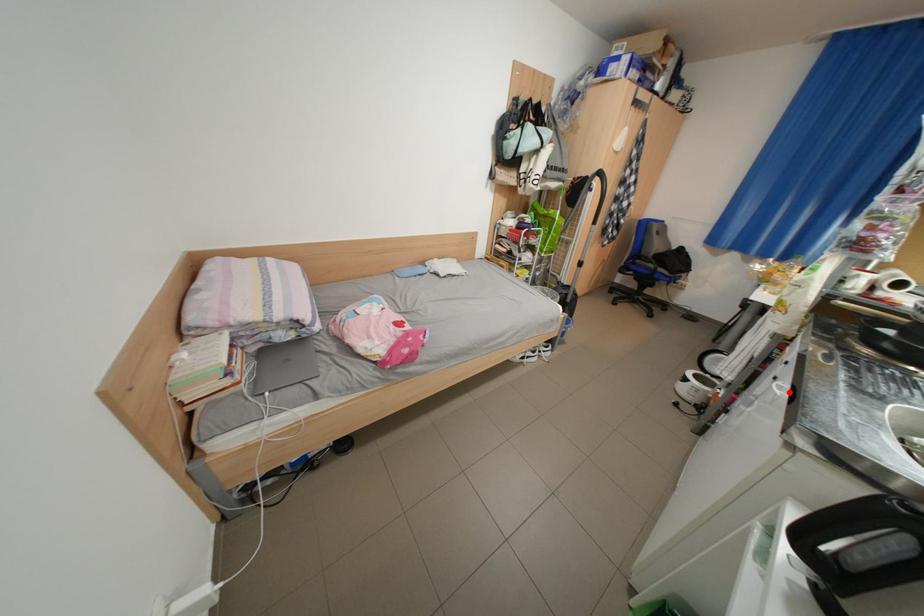
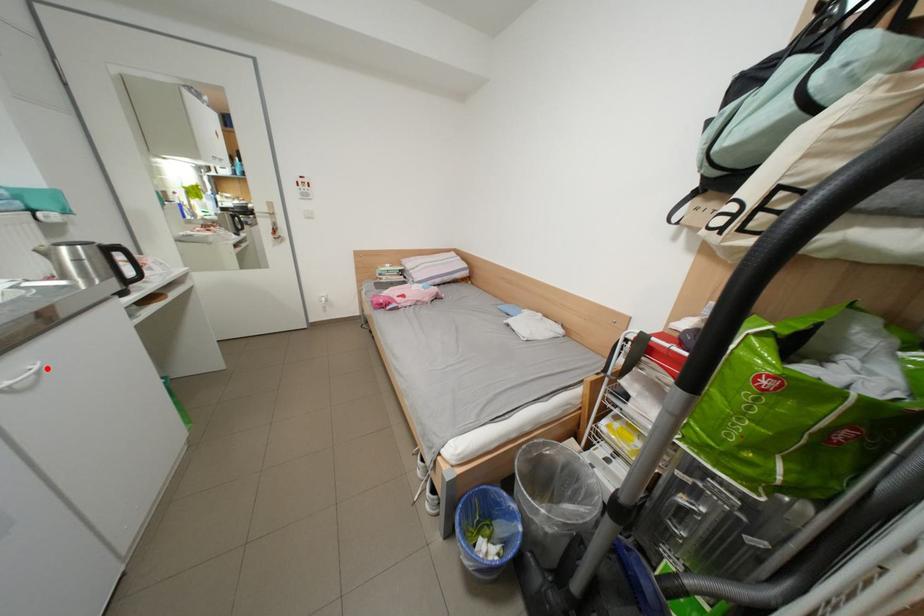
I am providing you with two images of the same scene from different viewpoints. A red point is marked on the first image and another point is marked on the second image. Is the marked point in image1 the same physical position as the marked point in image2?

Yes